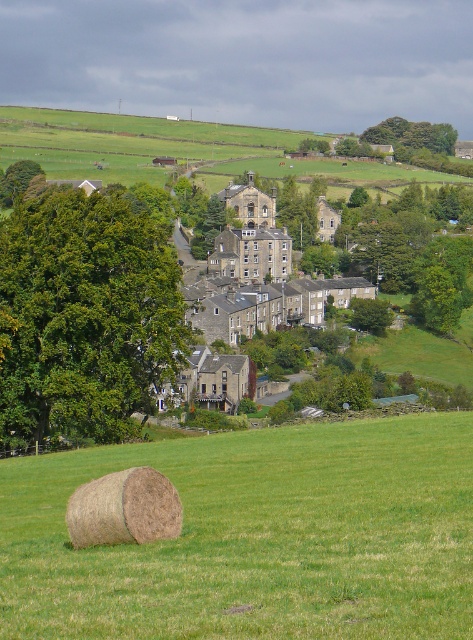
You are standing in the field near the brown straw bale at lower left and want to walk towards the stone houses at center. Which direction should you head?

You should head to the right because the stone houses at center are to the right of the brown straw bale at lower left.

You are standing at the origin point of the coordinate system, which is the lower left corner of the image. You want to walk towards the stone houses at center. In which direction should you move relative to the coordinate system?

The stone houses at center are located at coordinate point (245,285), so you should move northeast relative to the coordinate system since both the x and y values are greater than zero.